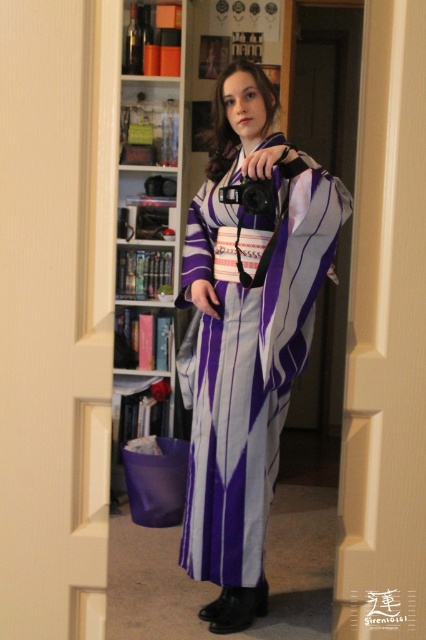
You are trying to decide whether to place a large potted plant between the white wooden bookshelf at center and the black plastic camera at center. Given their sizes, will the plant fit in the space between them?

The white wooden bookshelf at center is bigger than the black plastic camera at center, so there might be enough space to place a large potted plant between them, but the exact fit depends on the plant size and the distance between the two objects.

You are a photographer trying to capture a detailed closeup of the purple silk kimono at center. If your camera can focus on objects within 5 feet, will you need to move closer or farther away?

The purple silk kimono at center is 5.66 feet away from the camera. Since the camera can focus within 5 feet, you need to move closer to achieve a clear closeup.

You are standing in the doorway wearing a kimono and holding a camera. There is a white wooden bookshelf at center. Where is the point located at coordinates (149, 224) in relation to the white wooden bookshelf at center?

The point located at coordinates (149, 224) corresponds to the white wooden bookshelf at center.